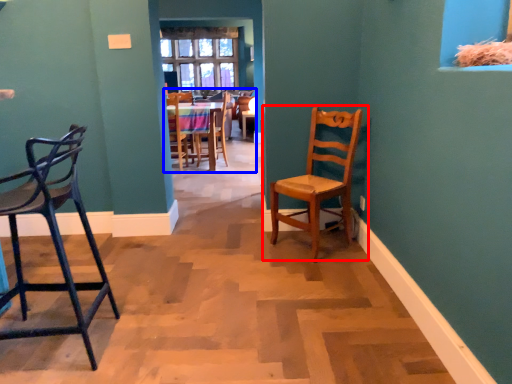
Question: Which object is closer to the camera taking this photo, chair (highlighted by a red box) or chair (highlighted by a blue box)?

Choices:
 (A) chair
 (B) chair

Answer: (A)